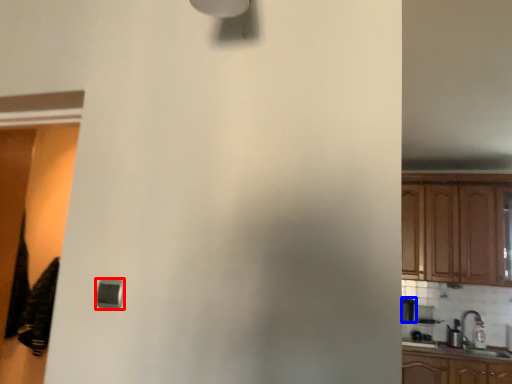
Question: Which object is closer to the camera taking this photo, light (highlighted by a red box) or appliance (highlighted by a blue box)?

Choices:
 (A) light
 (B) appliance

Answer: (A)